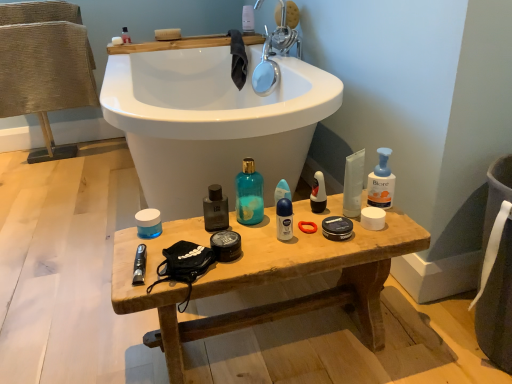
Question: Is matte plastic toothbrush at upper center, which appears as the 1th toiletry when viewed from the top, to the left or to the right of matte black bottle at center, placed as the 5th toiletry when sorted from top to bottom, in the image?

Choices:
 (A) right
 (B) left

Answer: (A)

Question: In terms of width, does matte plastic toothbrush at upper center, which appears as the 1th toiletry when viewed from the top, look wider or thinner when compared to matte black bottle at center, which appears as the 6th toiletry when viewed from the back?

Choices:
 (A) wide
 (B) thin

Answer: (A)

Question: Which is farther from the white matte soap at upper left?

Choices:
 (A) metallic silver spray can at upper left, placed as the 1th toiletry when sorted from left to right
 (B) wooden bench at center
 (C) white matte deodorant at center, marked as the 5th toiletry in a left-to-right arrangement
 (D) matte plastic toothbrush at upper center, which appears as the 1th toiletry when viewed from the top
 (E) translucent plastic jar at center, the 1th toiletry in the bottom-to-top sequence

Answer: (B)

Question: Based on their relative distances, which object is nearer to the metallic black razor at lower left?

Choices:
 (A) white matte deodorant at center, the 2th toiletry ordered from the bottom
 (B) wooden bench at center
 (C) blue pump bottle at right, which is the first cleaning product in right-to-left order
 (D) chrome metallic faucet at upper center
 (E) white matte soap at upper left

Answer: (A)